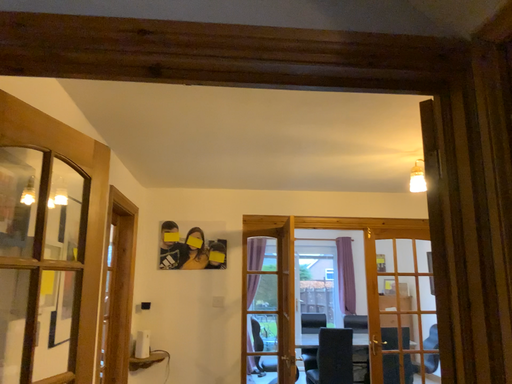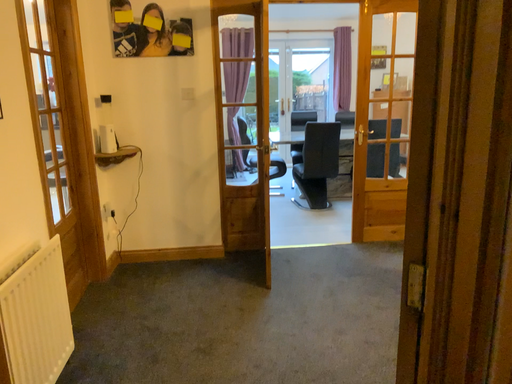
Question: How did the camera likely rotate when shooting the video?

Choices:
 (A) rotated upward
 (B) rotated downward

Answer: (B)